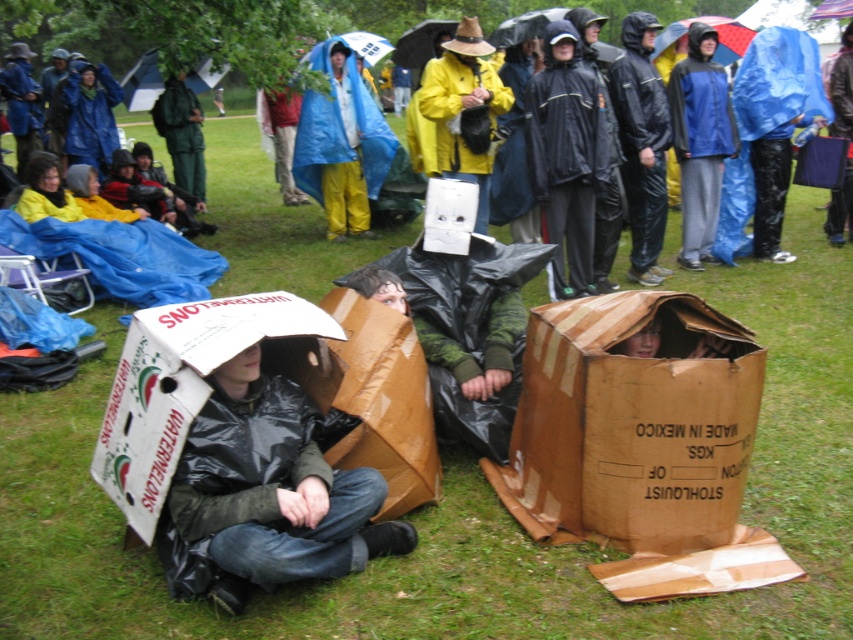
Question: Which of the following is the farthest from the observer?

Choices:
 (A) yellow matte raincoat at center
 (B) brown cardboard box at center
 (C) blue matte raincoat at upper right

Answer: (C)

Question: Can you confirm if matte black jacket at center is positioned to the left of yellow matte raincoat at center?

Choices:
 (A) yes
 (B) no

Answer: (A)

Question: Which point is closer to the camera?

Choices:
 (A) (223, 477)
 (B) (514, 433)
 (C) (474, 19)

Answer: (A)

Question: Is blue tarpaulin at center wider than yellow matte raincoat at center?

Choices:
 (A) no
 (B) yes

Answer: (B)

Question: Observing the image, what is the correct spatial positioning of matte black jacket at center in reference to yellow matte raincoat at center?

Choices:
 (A) above
 (B) below

Answer: (B)

Question: Which of the following is the closest to the observer?

Choices:
 (A) blue tarpaulin at center
 (B) brown cardboard box at center
 (C) yellow matte raincoat at center
 (D) matte black jacket at center

Answer: (D)